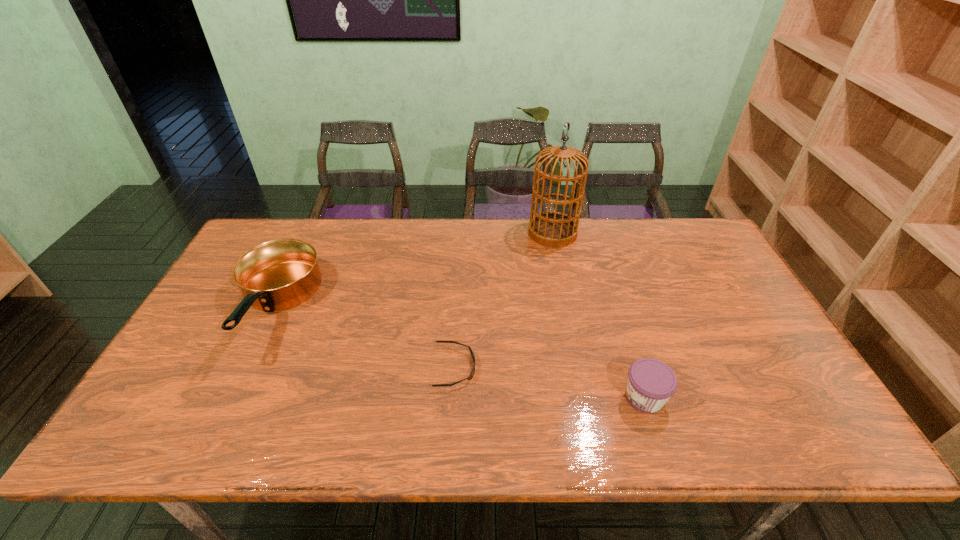
Find the location of a particular element. The height and width of the screenshot is (540, 960). birdcage is located at coordinates tap(552, 229).

Locate an element on the screen. The height and width of the screenshot is (540, 960). the tallest object is located at coordinates (552, 229).

At what (x,y) coordinates should I click in order to perform the action: click on the third shortest object. Please return your answer as a coordinate pair (x, y). Looking at the image, I should click on (280, 274).

Find the location of a particular element. The width and height of the screenshot is (960, 540). frying pan is located at coordinates (x=280, y=274).

At what (x,y) coordinates should I click in order to perform the action: click on jam. Please return your answer as a coordinate pair (x, y). This screenshot has height=540, width=960. Looking at the image, I should click on (651, 383).

This screenshot has width=960, height=540. What are the coordinates of `the shortest object` in the screenshot? It's located at (471, 375).

What are the coordinates of `sunglasses` in the screenshot? It's located at (471, 375).

This screenshot has height=540, width=960. In order to click on free spot located 0.240m on the left of the farthest object in this screenshot , I will do `click(459, 233)`.

At what (x,y) coordinates should I click in order to perform the action: click on vacant region located on the handle side of the leftmost object. Please return your answer as a coordinate pair (x, y). The image size is (960, 540). Looking at the image, I should click on pyautogui.click(x=226, y=407).

At what (x,y) coordinates should I click in order to perform the action: click on blank space located on the front label of the third tallest object. Please return your answer as a coordinate pair (x, y). The width and height of the screenshot is (960, 540). Looking at the image, I should click on (x=566, y=397).